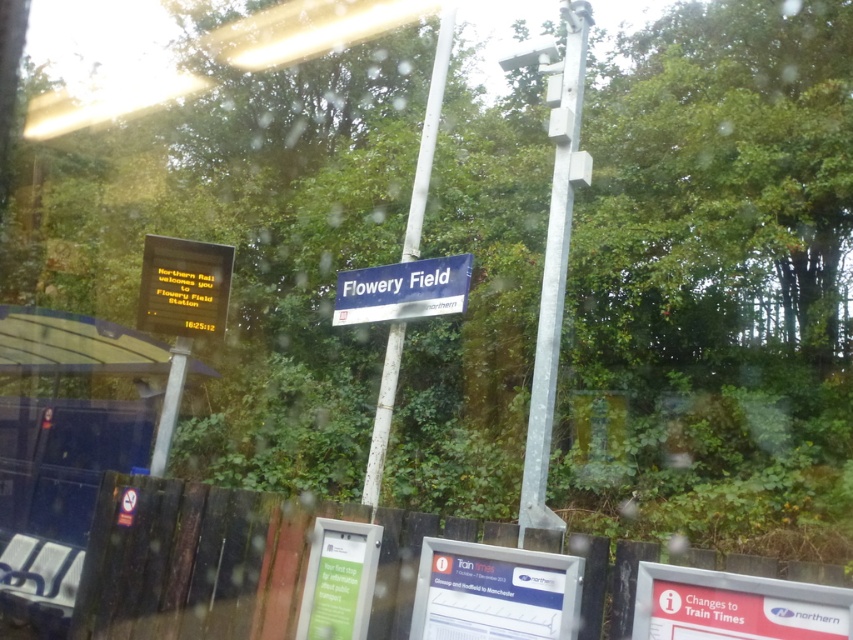
Is wooden bench at left taller than yellow digital display at upper left?

Yes, wooden bench at left is taller than yellow digital display at upper left.

Measure the distance between point (90, 522) and camera.

Point (90, 522) is 4.06 meters away from camera.

Between point (51, 323) and point (198, 259), which one is positioned behind?

Positioned behind is point (198, 259).

Find the location of a particular element. wooden bench at left is located at coordinates (62, 449).

Between yellow digital display at upper left and blue metallic signboard at center, which one appears on the right side from the viewer's perspective?

blue metallic signboard at center is more to the right.

Locate an element on the screen. The image size is (853, 640). yellow digital display at upper left is located at coordinates (183, 285).

Identify the location of yellow digital display at upper left. (183, 285).

Does white plastic sign at lower right appear on the left side of blue metallic signboard at center?

No, white plastic sign at lower right is not to the left of blue metallic signboard at center.

You are a GUI agent. You are given a task and a screenshot of the screen. Output one action in this format:
    pyautogui.click(x=<x>, y=<y>)
    Task: Click on the white plastic sign at lower right
    This screenshot has width=853, height=640.
    Given the screenshot: What is the action you would take?
    pyautogui.click(x=735, y=605)